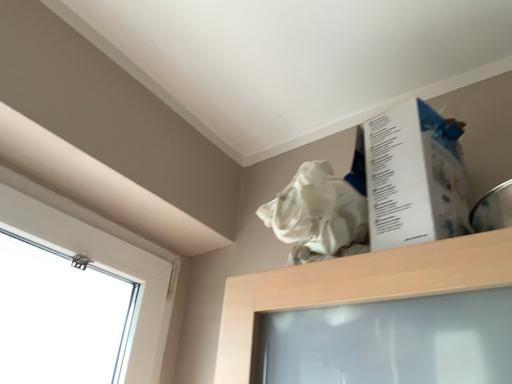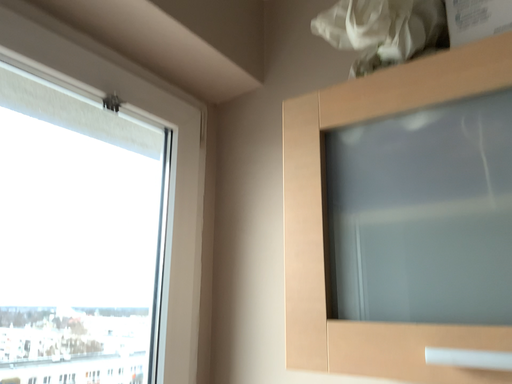
Question: Which way did the camera rotate in the video?

Choices:
 (A) rotated downward
 (B) rotated upward

Answer: (A)